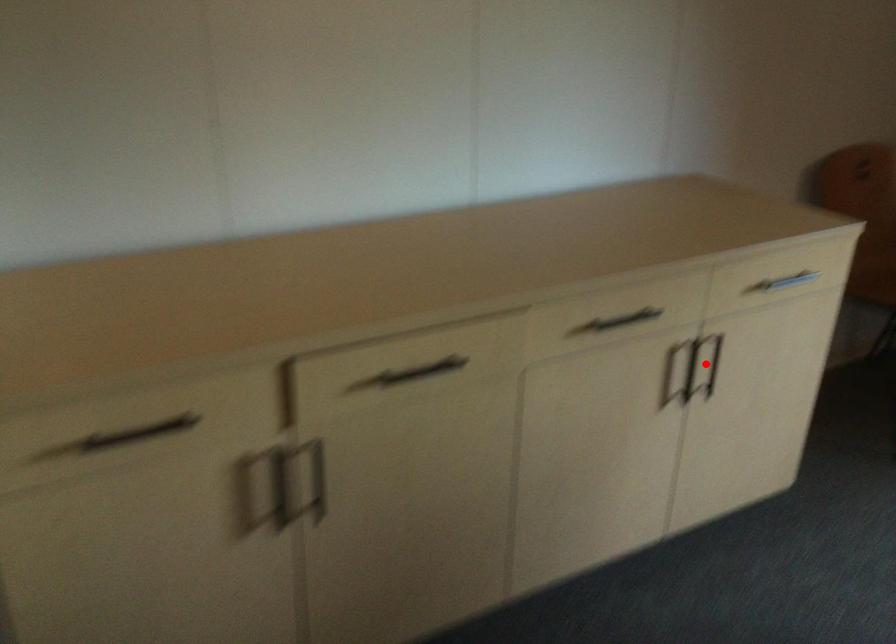
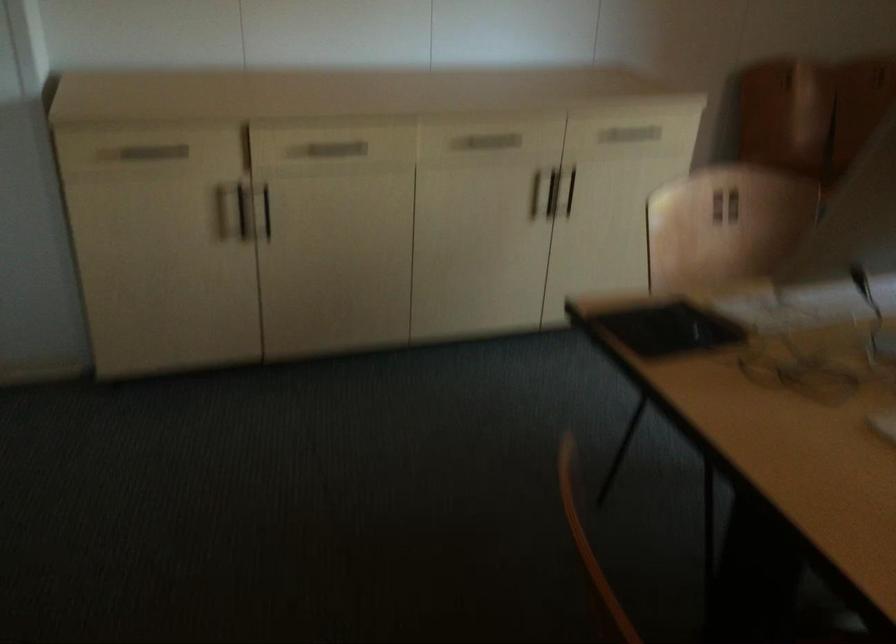
Question: I am providing you with two images of the same scene from different viewpoints. A red point is shown in image1. For the corresponding object point in image2, is it positioned nearer or farther from the camera?

Choices:
 (A) Nearer
 (B) Farther

Answer: (B)